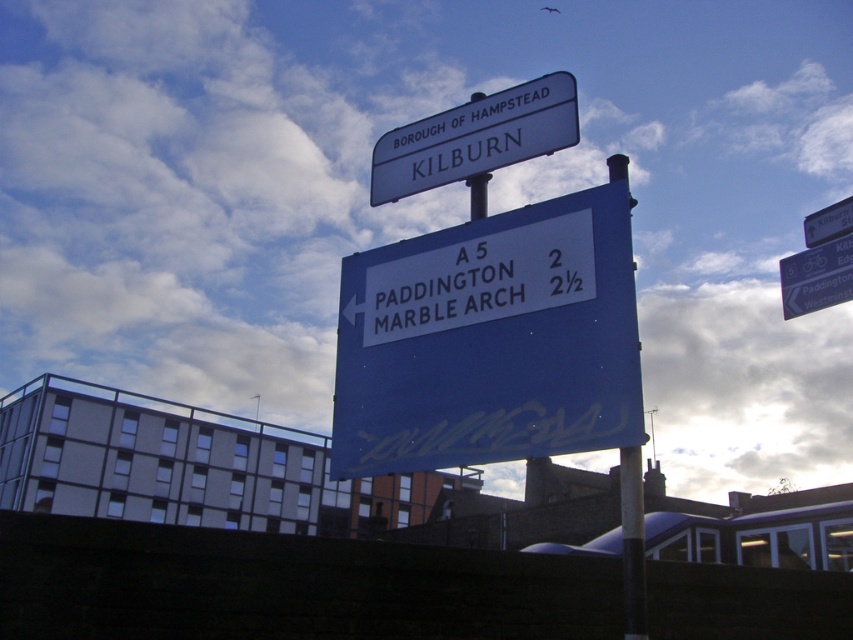
Between white plastic sign at center and white plastic street sign at upper center, which one appears on the right side from the viewer's perspective?

white plastic street sign at upper center

Is white plastic sign at center positioned before white plastic street sign at upper center?

Yes, it is in front of white plastic street sign at upper center.

At what (x,y) coordinates should I click in order to perform the action: click on white plastic sign at center. Please return your answer as a coordinate pair (x, y). This screenshot has height=640, width=853. Looking at the image, I should click on (479, 280).

At what (x,y) coordinates should I click in order to perform the action: click on white plastic sign at center. Please return your answer as a coordinate pair (x, y). The width and height of the screenshot is (853, 640). Looking at the image, I should click on (479, 280).

Which is above, white plastic sign at center or metallic pole at center?

white plastic sign at center is higher up.

Who is taller, white plastic sign at center or metallic pole at center?

Standing taller between the two is metallic pole at center.

Is point (527, 296) positioned before point (642, 557)?

No, it is behind (642, 557).

The height and width of the screenshot is (640, 853). What are the coordinates of `white plastic sign at center` in the screenshot? It's located at (479, 280).

Between point (544, 221) and point (631, 490), which one is positioned behind?

The point (544, 221) is behind.

Does blue painted metal sign at center have a lesser height compared to metallic pole at center?

Yes, blue painted metal sign at center is shorter than metallic pole at center.

Where is `blue painted metal sign at center`? The height and width of the screenshot is (640, 853). blue painted metal sign at center is located at coordinates (490, 340).